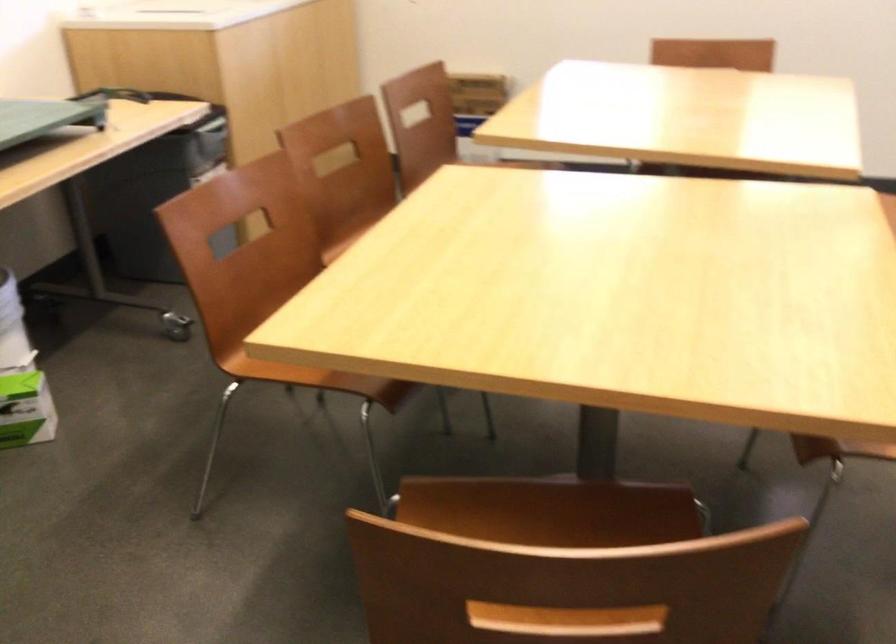
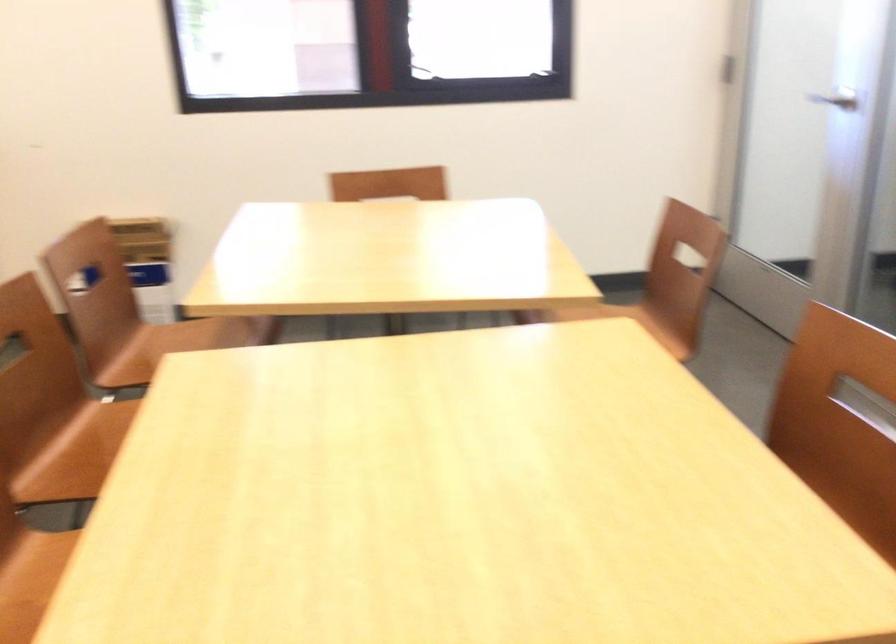
In a continuous first-person perspective shot, in which direction is the camera moving?

The cameraman walked toward left, forward.